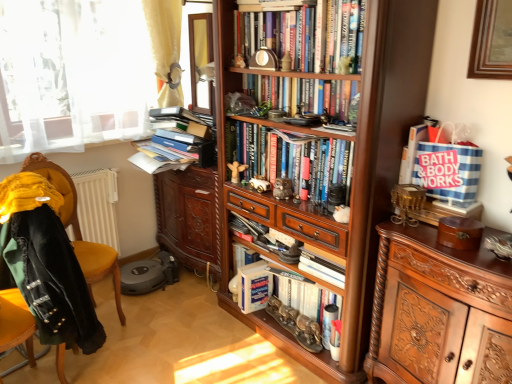
Image resolution: width=512 pixels, height=384 pixels. In order to click on empty space that is ontop of polished wood cabinet at right (from a real-world perspective) in this screenshot , I will do `click(451, 246)`.